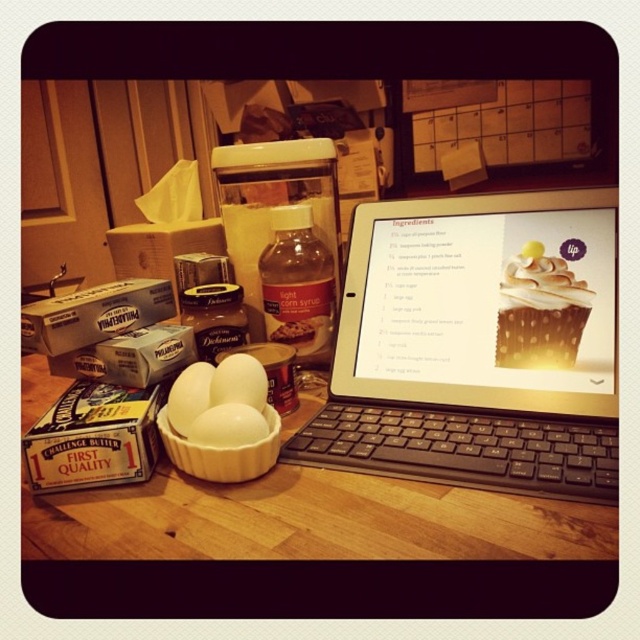
Is wooden table at center to the right of golden brown cake at upper right from the viewer's perspective?

In fact, wooden table at center is to the left of golden brown cake at upper right.

Is wooden table at center bigger than golden brown cake at upper right?

Yes.

Which is behind, point (44, 410) or point (531, 301)?

Positioned behind is point (44, 410).

Locate an element on the screen. The width and height of the screenshot is (640, 640). wooden table at center is located at coordinates (308, 520).

Who is taller, golden brown cake at upper right or white matte eggs at center?

Standing taller between the two is golden brown cake at upper right.

Does golden brown cake at upper right appear over white matte eggs at center?

Yes, golden brown cake at upper right is above white matte eggs at center.

Is point (545, 314) in front of point (252, 436)?

No.

Locate an element on the screen. The image size is (640, 640). golden brown cake at upper right is located at coordinates (540, 310).

Does point (193, 502) come in front of point (188, 406)?

Yes.

Can you confirm if wooden table at center is thinner than white matte egg at center?

No, wooden table at center is not thinner than white matte egg at center.

Is point (280, 506) positioned behind point (179, 426)?

No, (280, 506) is in front of (179, 426).

The image size is (640, 640). In order to click on wooden table at center in this screenshot , I will do pyautogui.click(x=308, y=520).